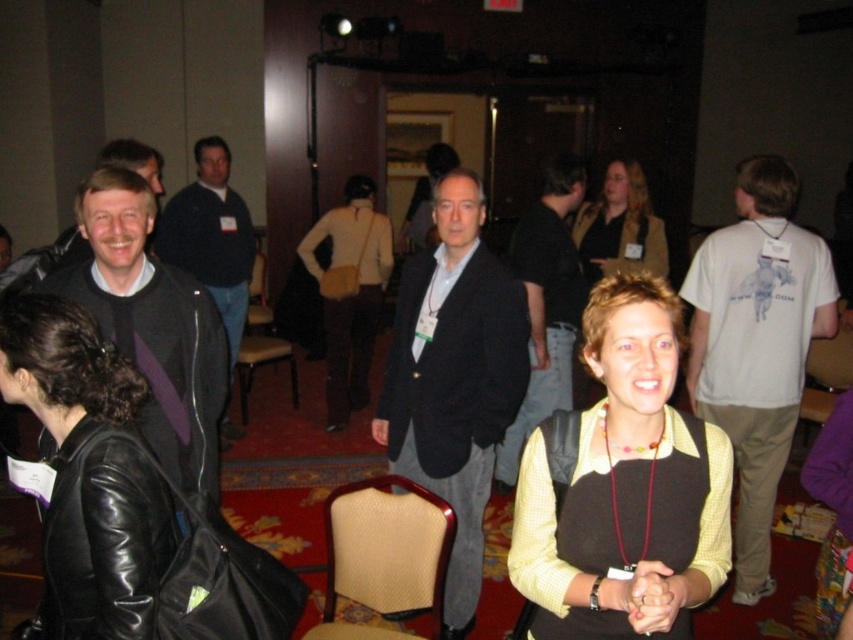
Question: Which of these objects is positioned closest to the matte black vest at center?

Choices:
 (A) white cotton t-shirt at right
 (B) shiny black leather jacket at left
 (C) dark gray blazer at center
 (D) dark gray suit at center

Answer: (D)

Question: Estimate the real-world distances between objects in this image. Which object is closer to the matte black jacket at left?

Choices:
 (A) matte black sweater at left
 (B) dark gray suit at center
 (C) dark gray blazer at center

Answer: (A)

Question: Does dark gray suit at center appear on the left side of black leather jacket at left?

Choices:
 (A) no
 (B) yes

Answer: (A)

Question: Is white cotton t-shirt at right closer to camera compared to matte black vest at center?

Choices:
 (A) yes
 (B) no

Answer: (A)

Question: Does matte yellow vest at center have a larger size compared to matte brown leather bag at center?

Choices:
 (A) yes
 (B) no

Answer: (B)

Question: Considering the real-world distances, which object is farthest from the matte brown leather bag at center?

Choices:
 (A) matte black jacket at left
 (B) matte black vest at center
 (C) shiny black leather jacket at left

Answer: (C)